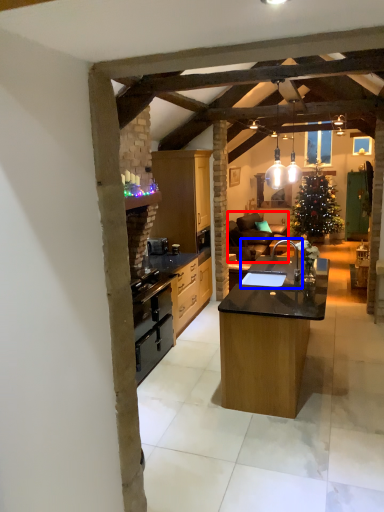
Question: Which point is further to the camera, studio couch (highlighted by a red box) or sink (highlighted by a blue box)?

Choices:
 (A) studio couch
 (B) sink

Answer: (A)